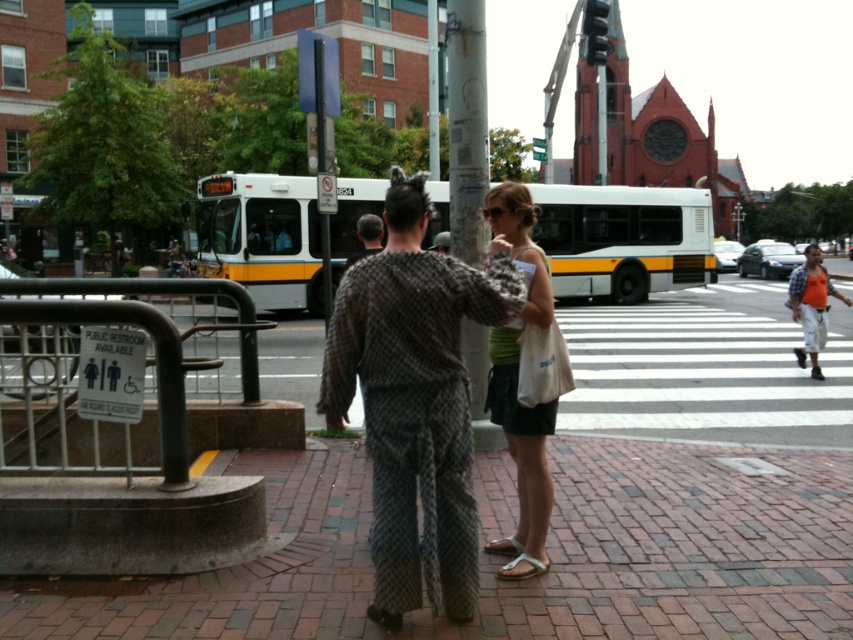
You are standing at the point marked by the coordinates point (569, 502). Looking around, you see the metal railing with the restroom sign on the left side of the frame. Which direction should you walk to reach the restroom?

The metal railing with the restroom sign is on the left side of the frame. Since you are at point (569, 502), which marks the brick pavement at center, you should walk towards the left to reach the restroom.